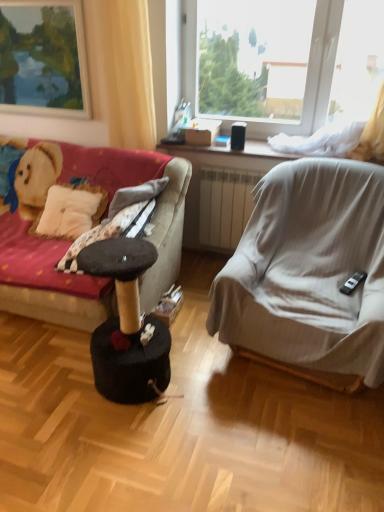
Find the location of a particular element. The image size is (384, 512). black felt cat tree at center is located at coordinates (126, 325).

Locate an element on the screen. The image size is (384, 512). yellow fabric curtain at upper left is located at coordinates (125, 72).

Locate an element on the screen. Image resolution: width=384 pixels, height=512 pixels. light gray fabric chair at right is located at coordinates (309, 270).

What do you see at coordinates (309, 270) in the screenshot? Image resolution: width=384 pixels, height=512 pixels. I see `light gray fabric chair at right` at bounding box center [309, 270].

Image resolution: width=384 pixels, height=512 pixels. Identify the location of velvet fabric couch at left. (168, 232).

From a real-world perspective, is light gray fabric chair at right under transparent plastic window at upper center?

Yes, from a real-world perspective, light gray fabric chair at right is under transparent plastic window at upper center.

Who is bigger, light gray fabric chair at right or transparent plastic window at upper center?

light gray fabric chair at right is bigger.

Is light gray fabric chair at right at the right side of transparent plastic window at upper center?

Yes.

Locate an element on the screen. chair on the right side of transparent plastic window at upper center is located at coordinates (309, 270).

Do you think light gray fabric chair at right is within matte wooden picture frame at upper left, or outside of it?

light gray fabric chair at right is outside matte wooden picture frame at upper left.

Is matte wooden picture frame at upper left at the back of light gray fabric chair at right?

No.

Considering the sizes of light gray fabric chair at right and matte wooden picture frame at upper left in the image, is light gray fabric chair at right wider or thinner than matte wooden picture frame at upper left?

In the image, light gray fabric chair at right appears to be wider than matte wooden picture frame at upper left.

From a real-world perspective, is light gray fabric chair at right below matte wooden picture frame at upper left?

Yes, from a real-world perspective, light gray fabric chair at right is under matte wooden picture frame at upper left.

From the image's perspective, is light gray fabric chair at right located above or below velvet fabric couch at left?

light gray fabric chair at right is below velvet fabric couch at left.

Is velvet fabric couch at left completely or partially inside light gray fabric chair at right?

No, velvet fabric couch at left is not inside light gray fabric chair at right.

Consider the image. Considering the positions of objects light gray fabric chair at right and velvet fabric couch at left in the image provided, who is more to the left, light gray fabric chair at right or velvet fabric couch at left?

velvet fabric couch at left.

From a real-world perspective, is light gray fabric chair at right beneath velvet fabric couch at left?

No, from a real-world perspective, light gray fabric chair at right is not under velvet fabric couch at left.

Who is taller, yellow fabric curtain at upper left or matte wooden picture frame at upper left?

With more height is yellow fabric curtain at upper left.

Could you tell me if yellow fabric curtain at upper left is turned towards matte wooden picture frame at upper left?

No, yellow fabric curtain at upper left is not aimed at matte wooden picture frame at upper left.

In terms of width, does yellow fabric curtain at upper left look wider or thinner when compared to matte wooden picture frame at upper left?

In the image, yellow fabric curtain at upper left appears to be wider than matte wooden picture frame at upper left.

Consider the image. Which of these two, yellow fabric curtain at upper left or matte wooden picture frame at upper left, is smaller?

Smaller between the two is matte wooden picture frame at upper left.

What's the angular difference between black felt cat tree at center and transparent plastic window at upper center's facing directions?

0.83 degrees.

Considering the sizes of black felt cat tree at center and transparent plastic window at upper center in the image, is black felt cat tree at center wider or thinner than transparent plastic window at upper center?

Clearly, black felt cat tree at center has more width compared to transparent plastic window at upper center.

Is transparent plastic window at upper center located within black felt cat tree at center?

No.

Which object is positioned more to the left, black felt cat tree at center or transparent plastic window at upper center?

black felt cat tree at center.

Does black felt cat tree at center appear on the right side of velvet fabric couch at left?

Yes.

From a real-world perspective, is black felt cat tree at center physically below velvet fabric couch at left?

Yes, from a real-world perspective, black felt cat tree at center is below velvet fabric couch at left.

Which object is further away from the camera, black felt cat tree at center or velvet fabric couch at left?

velvet fabric couch at left is behind.

Which of these two, black felt cat tree at center or velvet fabric couch at left, is thinner?

black felt cat tree at center is thinner.

Does point (104, 309) come closer to viewer compared to point (140, 145)?

Yes, it is in front of point (140, 145).

Is velvet fabric couch at left shorter than yellow fabric curtain at upper left?

Indeed, velvet fabric couch at left has a lesser height compared to yellow fabric curtain at upper left.

Considering the sizes of objects velvet fabric couch at left and yellow fabric curtain at upper left in the image provided, who is wider, velvet fabric couch at left or yellow fabric curtain at upper left?

velvet fabric couch at left is wider.

Is velvet fabric couch at left not near yellow fabric curtain at upper left?

They are positioned close to each other.

At what (x,y) coordinates should I click in order to perform the action: click on chair beneath the transparent plastic window at upper center (from a real-world perspective). Please return your answer as a coordinate pair (x, y). The image size is (384, 512). Looking at the image, I should click on (309, 270).

The width and height of the screenshot is (384, 512). Identify the location of chair on the right of the matte wooden picture frame at upper left. (309, 270).

Looking at the image, which one is located further to black felt cat tree at center, matte wooden picture frame at upper left or velvet fabric couch at left?

matte wooden picture frame at upper left is further to black felt cat tree at center.

Looking at the image, which one is located closer to yellow fabric curtain at upper left, velvet fabric couch at left or matte wooden picture frame at upper left?

Based on the image, matte wooden picture frame at upper left appears to be nearer to yellow fabric curtain at upper left.

Considering their positions, is matte wooden picture frame at upper left positioned closer to velvet fabric couch at left than transparent plastic window at upper center?

transparent plastic window at upper center is positioned closer to the anchor velvet fabric couch at left.

Based on their spatial positions, is velvet fabric couch at left or transparent plastic window at upper center closer to matte wooden picture frame at upper left?

transparent plastic window at upper center is closer to matte wooden picture frame at upper left.

In the scene shown: Estimate the real-world distances between objects in this image. Which object is closer to matte wooden picture frame at upper left, transparent plastic window at upper center or velvet fabric couch at left?

The object closer to matte wooden picture frame at upper left is transparent plastic window at upper center.

Considering their positions, is yellow fabric curtain at upper left positioned closer to matte wooden picture frame at upper left than velvet fabric couch at left?

yellow fabric curtain at upper left.

From the image, which object appears to be farther from transparent plastic window at upper center, black felt cat tree at center or matte wooden picture frame at upper left?

black felt cat tree at center.

Estimate the real-world distances between objects in this image. Which object is further from velvet fabric couch at left, light gray fabric chair at right or transparent plastic window at upper center?

transparent plastic window at upper center.

Identify the location of music stool situated between velvet fabric couch at left and transparent plastic window at upper center from left to right. (126, 325).

The height and width of the screenshot is (512, 384). I want to click on curtain between velvet fabric couch at left and light gray fabric chair at right in the horizontal direction, so click(125, 72).

Locate an element on the screen. The height and width of the screenshot is (512, 384). curtain between matte wooden picture frame at upper left and light gray fabric chair at right is located at coordinates (125, 72).

Identify the location of curtain between velvet fabric couch at left and transparent plastic window at upper center. This screenshot has width=384, height=512. (125, 72).